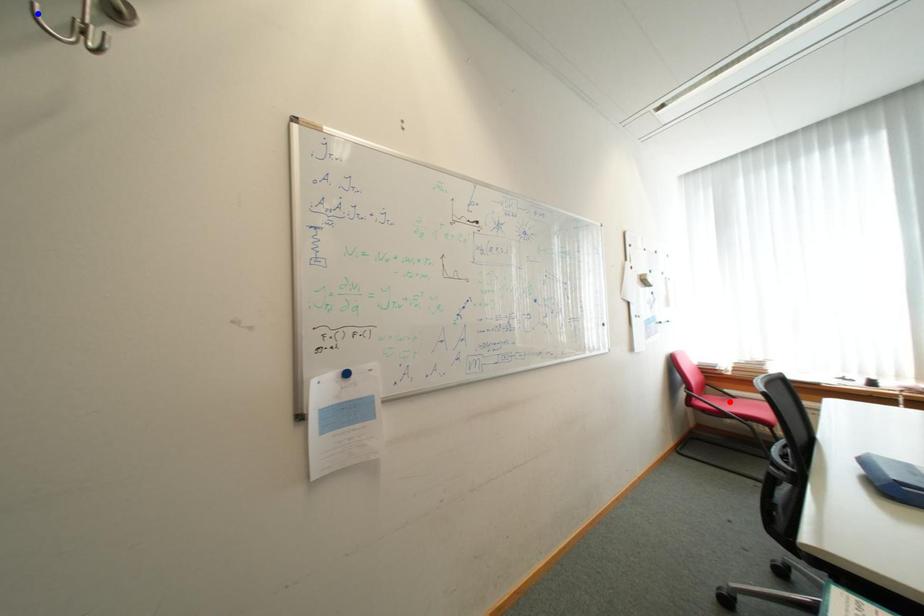
Question: Which of the two points in the image is closer to the camera?

Choices:
 (A) Blue point is closer.
 (B) Red point is closer.

Answer: (A)